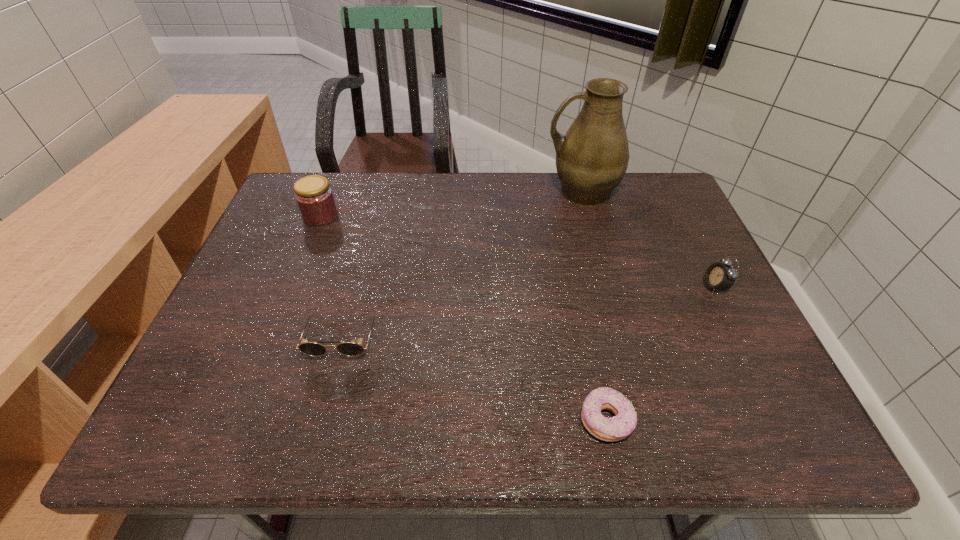
Locate an element on the screen. The image size is (960, 540). object that is the fourth closest one to the doughnut is located at coordinates (315, 199).

The image size is (960, 540). Find the location of `object that is the nearest to the shortest object`. object that is the nearest to the shortest object is located at coordinates (719, 276).

What are the coordinates of `blank space that satisfies the following two spatial constraints: 1. on the back side of the shortest object; 2. on the handle side of the pitcher` in the screenshot? It's located at (558, 192).

Where is `free space that satisfies the following two spatial constraints: 1. on the face of the alarm clock; 2. on the front lenses of the fourth farthest object`? This screenshot has width=960, height=540. free space that satisfies the following two spatial constraints: 1. on the face of the alarm clock; 2. on the front lenses of the fourth farthest object is located at coordinates (740, 338).

I want to click on blank area in the image that satisfies the following two spatial constraints: 1. on the back side of the shortest object; 2. on the handle side of the tallest object, so click(558, 192).